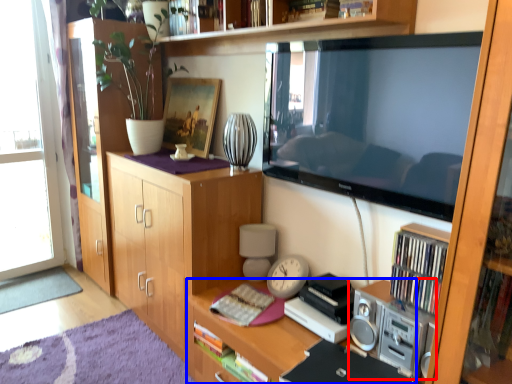
Question: Which of the following is the closest to the observer, stereo (highlighted by a red box) or desk (highlighted by a blue box)?

Choices:
 (A) stereo
 (B) desk

Answer: (B)